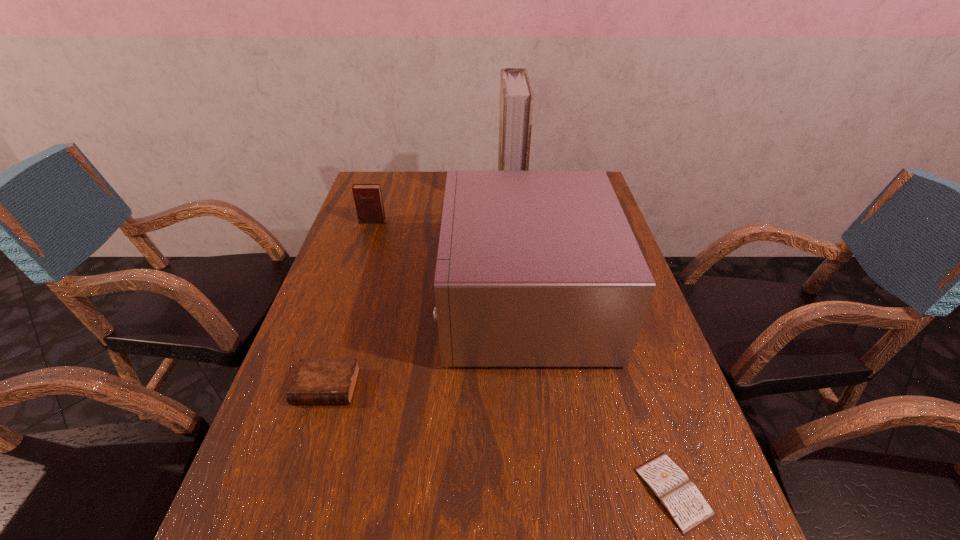
Identify the location of diary present at the right edge. The image size is (960, 540). (681, 499).

The width and height of the screenshot is (960, 540). Find the location of `blank space at the far edge of the desktop`. blank space at the far edge of the desktop is located at coordinates (427, 187).

In the image, there is a desktop. Where is `free space at the left edge`? free space at the left edge is located at coordinates click(369, 226).

In the image, there is a desktop. Where is `free space at the right edge`? This screenshot has width=960, height=540. free space at the right edge is located at coordinates click(642, 412).

In the image, there is a desktop. Where is `vacant space at the far left corner`? vacant space at the far left corner is located at coordinates (400, 195).

Find the location of `free space between the nearest object and the microwave oven`. free space between the nearest object and the microwave oven is located at coordinates (599, 396).

At what (x,y) coordinates should I click in order to perform the action: click on vacant point located between the fourth nearest object and the tallest object. Please return your answer as a coordinate pair (x, y). The width and height of the screenshot is (960, 540). Looking at the image, I should click on (442, 208).

Where is `unoccupied area between the second shortest object and the tallest object`? The image size is (960, 540). unoccupied area between the second shortest object and the tallest object is located at coordinates tap(419, 291).

Identify the location of free space between the second shortest object and the third shortest object. (349, 304).

Find the location of a particular element. The image size is (960, 540). free space between the second nearest diary and the microwave oven is located at coordinates (425, 343).